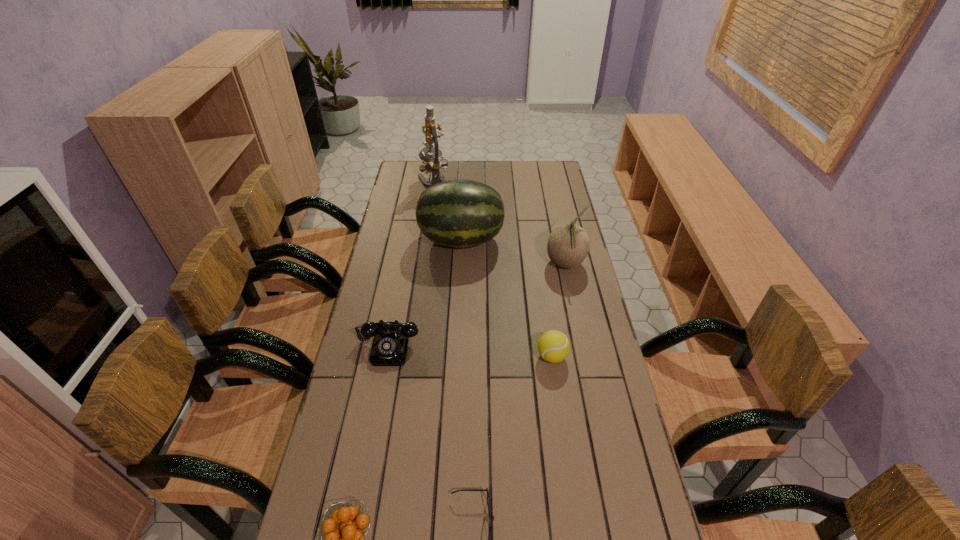
I want to click on vacant space situated 0.080m on the dial of the telephone, so click(380, 390).

In order to click on object that is positioned at the far edge in this screenshot , I will do `click(432, 163)`.

Locate an element on the screen. Image resolution: width=960 pixels, height=540 pixels. microscope located at the left edge is located at coordinates (432, 163).

The width and height of the screenshot is (960, 540). I want to click on watermelon that is at the left edge, so [x=459, y=213].

This screenshot has height=540, width=960. I want to click on telephone located at the left edge, so click(390, 344).

Identify the location of cantaloup present at the right edge. This screenshot has height=540, width=960. [568, 244].

Where is `tennis ball at the right edge`? Image resolution: width=960 pixels, height=540 pixels. tennis ball at the right edge is located at coordinates (553, 346).

Identify the location of object located at the far left corner. (432, 163).

In the image, there is a desktop. Identify the location of vacant space at the far edge. (467, 176).

This screenshot has height=540, width=960. In the image, there is a desktop. What are the coordinates of `vacant space at the left edge` in the screenshot? It's located at (396, 311).